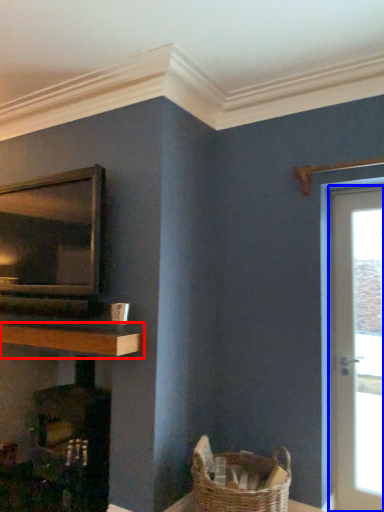
Question: Which point is closer to the camera, shelf (highlighted by a red box) or door (highlighted by a blue box)?

Choices:
 (A) shelf
 (B) door

Answer: (A)